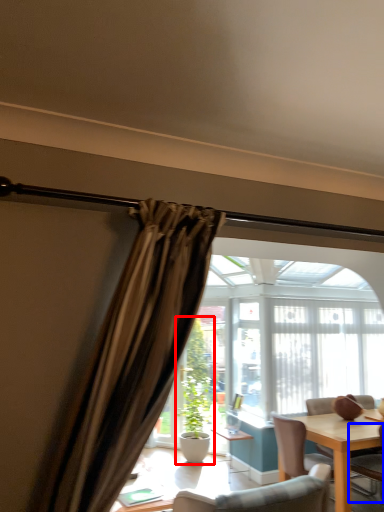
Question: Which object appears farthest to the camera in this image, houseplant (highlighted by a red box) or chair (highlighted by a blue box)?

Choices:
 (A) houseplant
 (B) chair

Answer: (A)